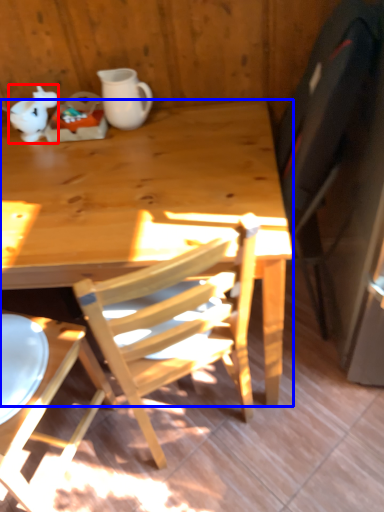
Question: Which object is further to the camera taking this photo, teapot (highlighted by a red box) or desk (highlighted by a blue box)?

Choices:
 (A) teapot
 (B) desk

Answer: (A)